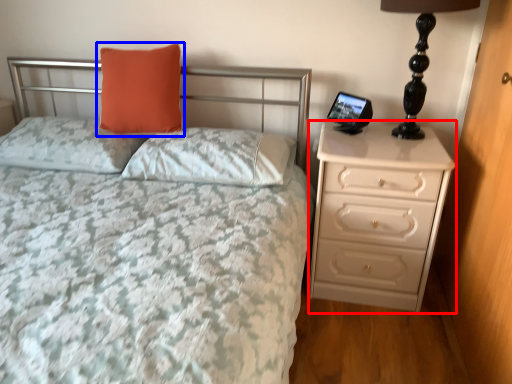
Question: Which point is further to the camera, chest of drawers (highlighted by a red box) or pillow (highlighted by a blue box)?

Choices:
 (A) chest of drawers
 (B) pillow

Answer: (B)